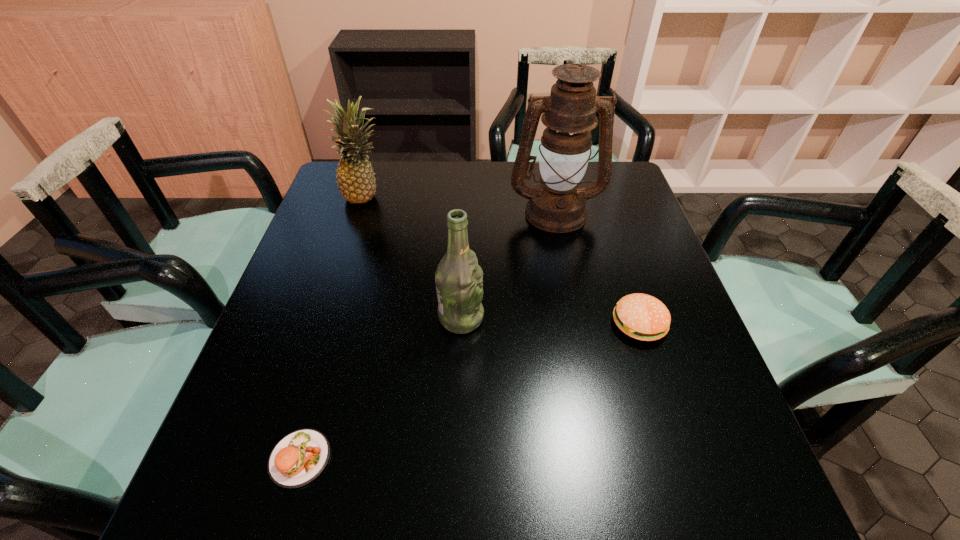
This screenshot has width=960, height=540. I want to click on vacant point located on the back of the right patty, so click(x=617, y=257).

Find the location of `blank space located on the left of the shorter patty`. blank space located on the left of the shorter patty is located at coordinates (224, 458).

This screenshot has width=960, height=540. I want to click on oil lamp located at the far edge, so click(x=557, y=205).

Where is `pineapple located at the far edge`? pineapple located at the far edge is located at coordinates (355, 177).

Find the location of a particular element. This screenshot has width=960, height=540. object situated at the near edge is located at coordinates (300, 457).

Locate an element on the screen. pineapple that is positioned at the left edge is located at coordinates (355, 177).

You are a GUI agent. You are given a task and a screenshot of the screen. Output one action in this format:
    pyautogui.click(x=<x>, y=<y>)
    Task: Click on the patty at the left edge
    The height and width of the screenshot is (540, 960).
    Given the screenshot: What is the action you would take?
    pyautogui.click(x=300, y=457)

The image size is (960, 540). Find the location of `oil lamp that is positioned at the right edge`. oil lamp that is positioned at the right edge is located at coordinates (557, 205).

Where is `patty situated at the right edge`? The image size is (960, 540). patty situated at the right edge is located at coordinates tap(643, 317).

This screenshot has width=960, height=540. I want to click on object that is at the far left corner, so click(x=355, y=177).